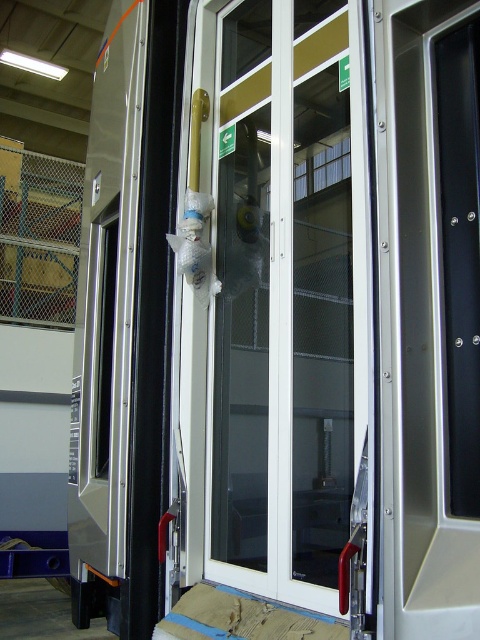
You are a bus inspector checking the door assembly. The transparent plastic door at center and the satin silver panel at right are both part of the bus door system. Based on their positions, which one is more likely to be the main door panel?

The transparent plastic door at center is more likely to be the main door panel since it is positioned centrally, which is typical for main door panels in bus designs.

You are a technician inspecting the bus door in the workshop. You notice two points marked on the door frame at coordinates point (227, 554) and point (451, 122). Which point is closer to your current position?

Point (227, 554) is further to the camera than point (451, 122), so the point closer to your current position is point (451, 122).

You are a mechanic working in the bus maintenance facility. You need to access the satin silver panel at right to perform maintenance. However, the transparent plastic door at center is blocking your way. Can you open the door to reach the panel?

The transparent plastic door at center is positioned over the satin silver panel at right, so you can open the transparent plastic door at center to access the satin silver panel at right.